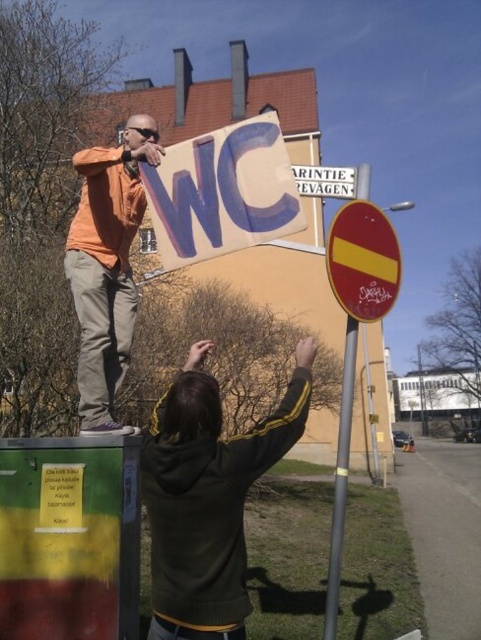
Question: Observing the image, what is the correct spatial positioning of dark green hoodie at center in reference to metallic reflective sign at center?

Choices:
 (A) below
 (B) above

Answer: (A)

Question: Among these points, which one is nearest to the camera?

Choices:
 (A) (211, 552)
 (B) (304, 180)
 (C) (370, 209)
 (D) (336, 483)

Answer: (A)

Question: Can you confirm if dark green hoodie at center is wider than metallic reflective sign at center?

Choices:
 (A) yes
 (B) no

Answer: (A)

Question: Which object is farther from the camera taking this photo?

Choices:
 (A) white plastic sign at upper center
 (B) dark green hoodie at center
 (C) metallic gray pole at center
 (D) metallic reflective sign at center

Answer: (A)

Question: Which object is positioned farthest from the orange matte jacket at upper left?

Choices:
 (A) dark green hoodie at center
 (B) metallic reflective sign at center
 (C) metallic gray pole at center

Answer: (C)

Question: Is metallic reflective sign at center above white plastic sign at upper center?

Choices:
 (A) no
 (B) yes

Answer: (A)